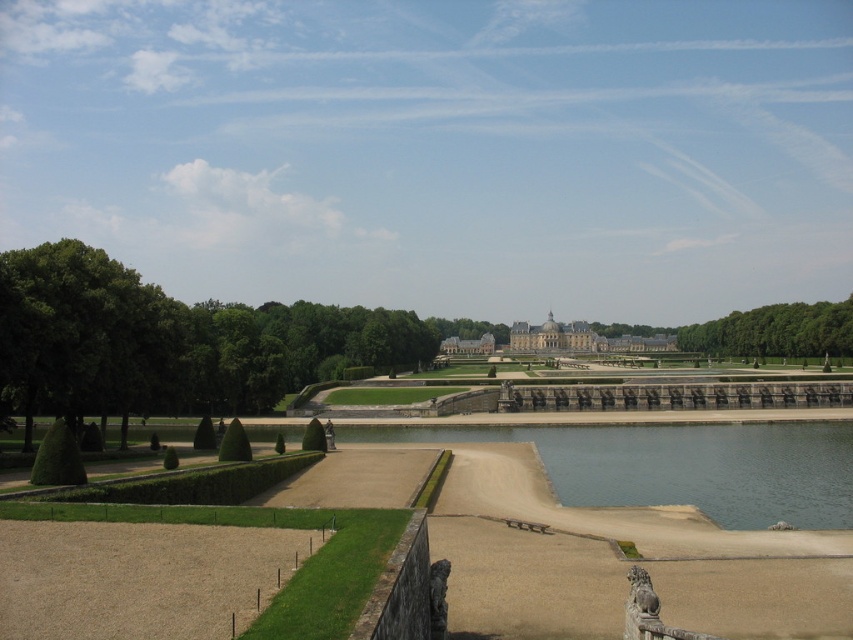
Does green leafy tree at center have a lesser height compared to stone gray palace at center?

Incorrect, green leafy tree at center's height does not fall short of stone gray palace at center's.

What are the coordinates of `green leafy tree at center` in the screenshot? It's located at (775, 332).

This screenshot has height=640, width=853. I want to click on green leafy tree at center, so click(x=775, y=332).

This screenshot has height=640, width=853. Identify the location of green leafy tree at center. (775, 332).

Which is more to the left, green leafy tree at left or green leafy tree at center?

From the viewer's perspective, green leafy tree at left appears more on the left side.

Can you confirm if green leafy tree at left is positioned to the left of green leafy tree at center?

Yes, green leafy tree at left is to the left of green leafy tree at center.

Locate an element on the screen. This screenshot has width=853, height=640. green leafy tree at left is located at coordinates (164, 340).

Locate an element on the screen. Image resolution: width=853 pixels, height=640 pixels. green leafy tree at left is located at coordinates (164, 340).

Identify the location of green leafy tree at left. The width and height of the screenshot is (853, 640). (164, 340).

Who is more distant from viewer, (x=142, y=291) or (x=125, y=477)?

Point (x=142, y=291)

Which is behind, point (55, 352) or point (231, 472)?

The point (55, 352) is behind.

The image size is (853, 640). I want to click on green leafy tree at left, so click(x=164, y=340).